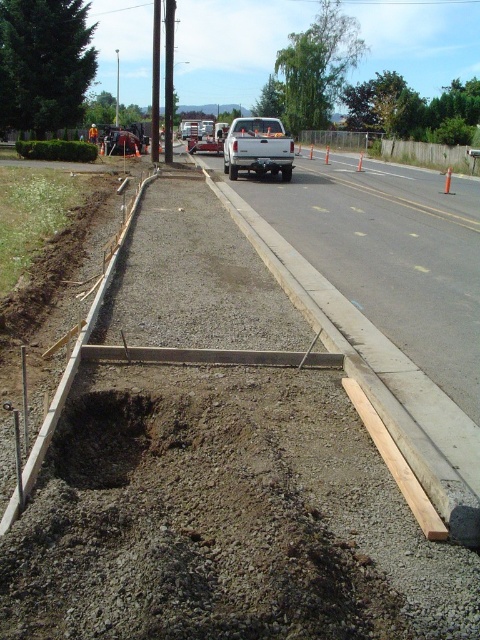
Question: Is brown gravel at center bigger than white matte truck at center?

Choices:
 (A) yes
 (B) no

Answer: (B)

Question: Which point is farther from the camera taking this photo?

Choices:
 (A) (257, 122)
 (B) (94, 125)

Answer: (B)

Question: Among these points, which one is nearest to the camera?

Choices:
 (A) (264, 163)
 (B) (92, 132)

Answer: (A)

Question: Where is brown gravel at center located in relation to brown dirt hole at center in the image?

Choices:
 (A) above
 (B) below

Answer: (B)

Question: Which of these objects is positioned farthest from the brown dirt hole at center?

Choices:
 (A) brown gravel at center
 (B) orange safety vest at center
 (C) brushed metal truck at center

Answer: (B)

Question: Is brown gravel at center smaller than brushed metal truck at center?

Choices:
 (A) yes
 (B) no

Answer: (A)